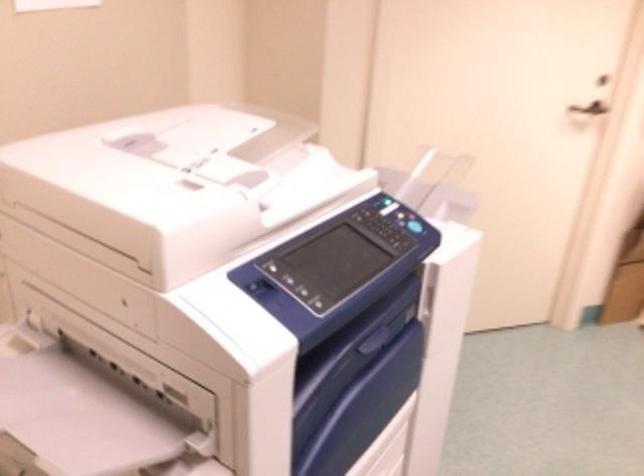
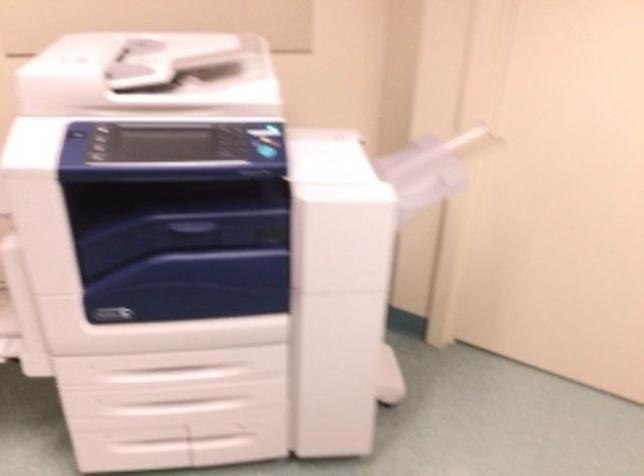
Locate, in the second image, the point that corresponds to pixel 393 233 in the first image.

(232, 150)